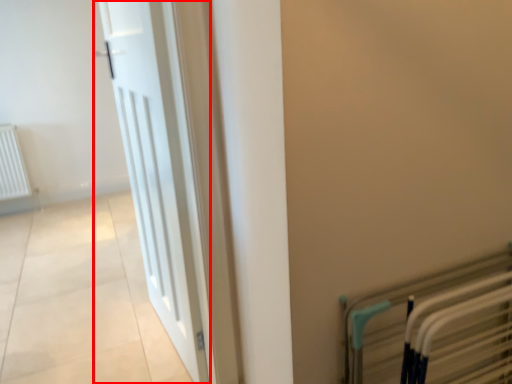
Question: In this image, where is door (annotated by the red box) located relative to bed frame?

Choices:
 (A) right
 (B) left

Answer: (B)